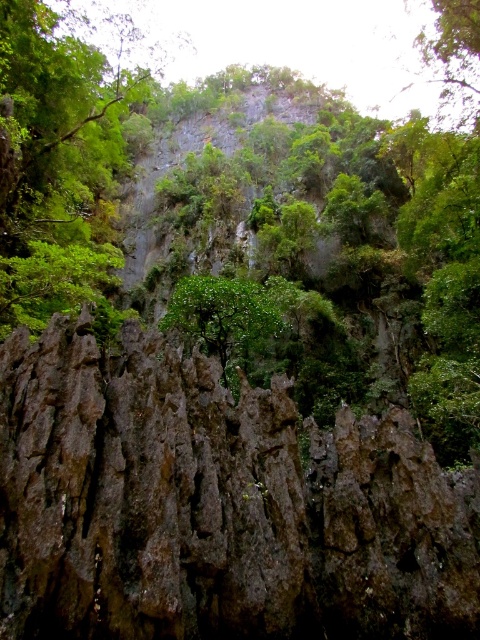
Question: Which of the following is the farthest from the observer?

Choices:
 (A) 12,90
 (B) 196,292
 (C) 37,570

Answer: (A)

Question: Which object is positioned closest to the dark brown rocky cliff at center?

Choices:
 (A) green leafy tree at upper center
 (B) green leafy tree at center

Answer: (B)

Question: Can you confirm if dark brown rocky cliff at center is positioned to the left of green leafy tree at upper center?

Choices:
 (A) no
 (B) yes

Answer: (A)

Question: Is green leafy tree at upper center in front of green leafy tree at center?

Choices:
 (A) yes
 (B) no

Answer: (B)

Question: Does dark brown rocky cliff at center have a larger size compared to green leafy tree at upper center?

Choices:
 (A) no
 (B) yes

Answer: (A)

Question: Which of the following is the closest to the observer?

Choices:
 (A) (229, 296)
 (B) (288, 532)
 (C) (43, 298)

Answer: (B)